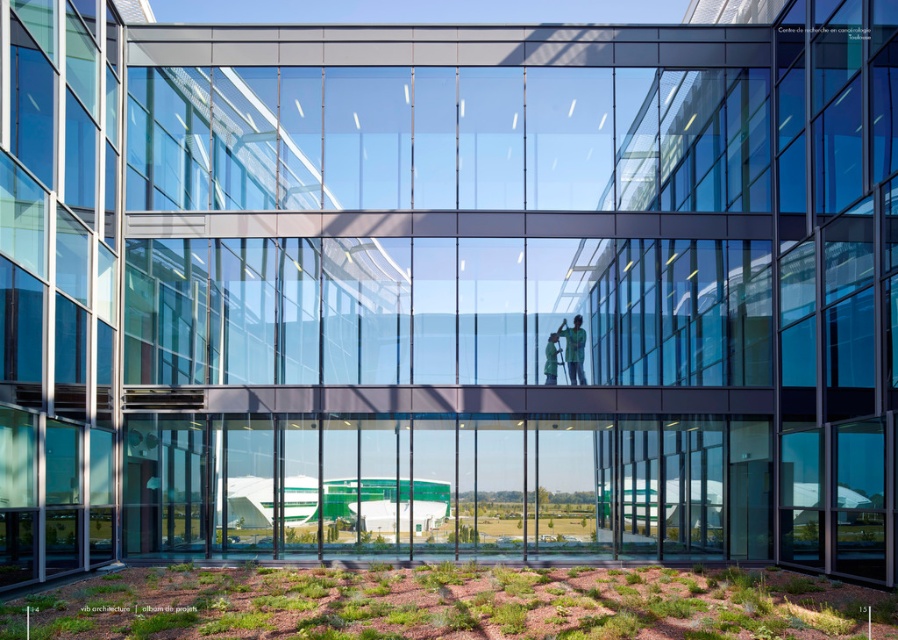
In the scene shown: You are an architect reviewing the design of the modern building with a glass facade. You notice two green fabric elements in the image. One is labeled as the green fabric person at center and the other as the green fabric at center. Which of these two elements is closer to the viewer?

The green fabric person at center is closer to the viewer because it is positioned in front of the green fabric at center.

You are an interior designer assessing the space inside the modern architectural structure. You notice a green fabric person at center and a green fabric at center. Which object occupies more horizontal space in the room?

The green fabric person at center might be wider than green fabric at center.